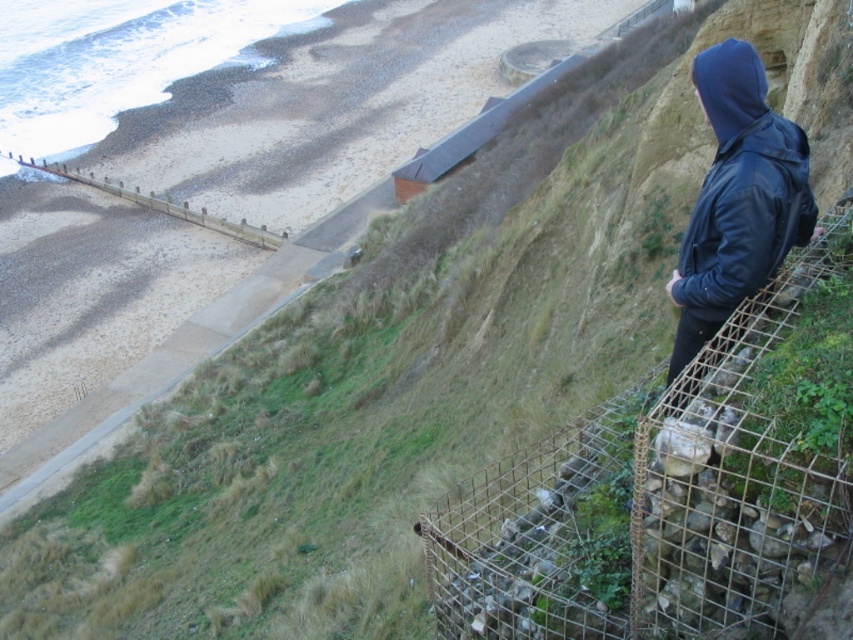
Consider the image. You are standing at the center of the image and want to walk towards the metal wire mesh at right. In which direction should you move?

You should move to the right since the metal wire mesh at right is located at the right side of the image.

You are a hiker who wants to take a shortcut down the slope. You see the metal wire mesh at right and the black leather jacket at right. Which object is closer to the bottom of the slope?

The metal wire mesh at right is closer to the bottom of the slope because it is positioned below the black leather jacket at right.